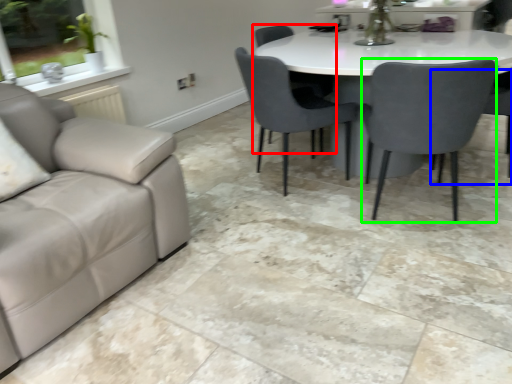
Question: Which is farther away from chair (highlighted by a red box)? chair (highlighted by a blue box) or chair (highlighted by a green box)?

Choices:
 (A) chair
 (B) chair

Answer: (A)